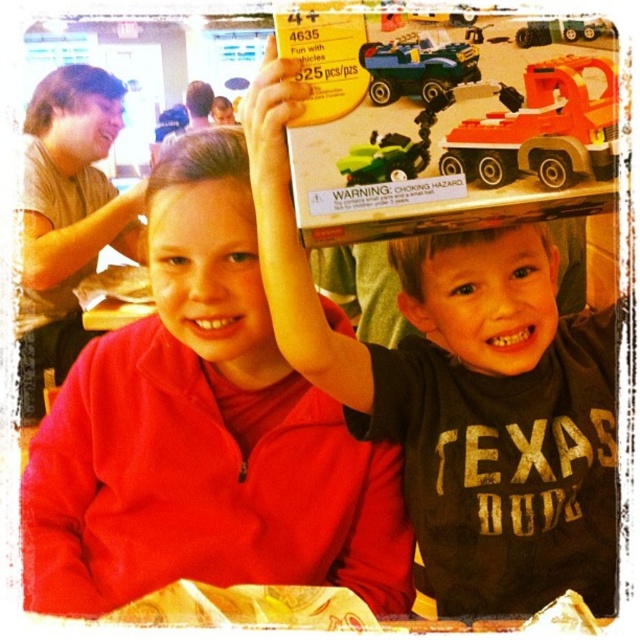
You are standing in the store and see two points marked in the scene. Which point is closer to you, point (508, 488) or point (538, 170)?

Point (508, 488) is closer to you because it is further to the viewer than point (538, 170).

You are a store employee organizing items. You need to place the matte red jacket at center and the black matte toy box at upper center on a shelf. If the shelf has limited space, which item should you place first to ensure both fit?

Since the matte red jacket at center occupies less space than the black matte toy box at upper center, you should place the black matte toy box at upper center first to accommodate its larger size, then fit the smaller matte red jacket at center alongside it.